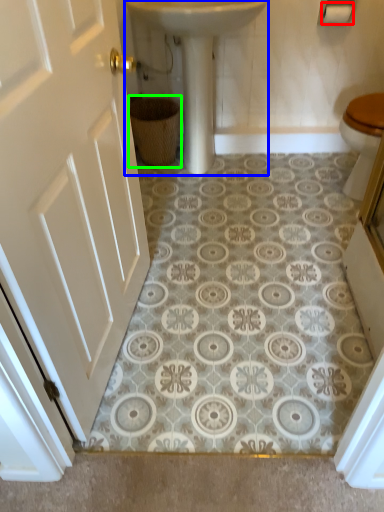
Question: Considering the real-world distances, which object is closest to toilet paper (highlighted by a red box)? sink (highlighted by a blue box) or basket (highlighted by a green box).

Choices:
 (A) sink
 (B) basket

Answer: (A)